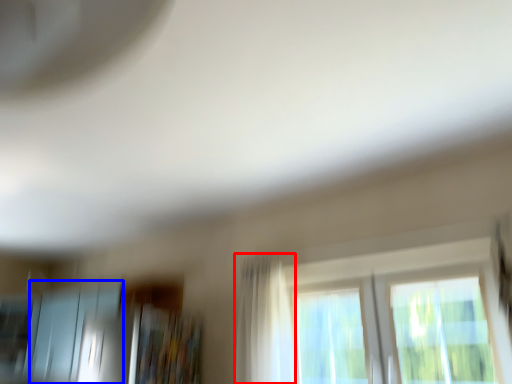
Question: Which of the following is the farthest to the observer, curtain (highlighted by a red box) or screen door (highlighted by a blue box)?

Choices:
 (A) curtain
 (B) screen door

Answer: (B)